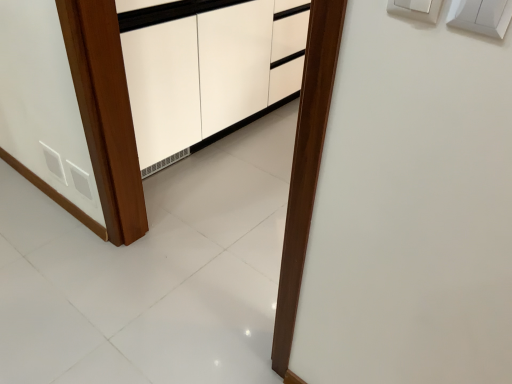
Question: Considering their positions, is white plastic light switch at upper right located in front of or behind white plastic switch at upper right?

Choices:
 (A) front
 (B) behind

Answer: (A)

Question: Considering the positions of white plastic light switch at upper right and white plastic switch at upper right in the image, is white plastic light switch at upper right taller or shorter than white plastic switch at upper right?

Choices:
 (A) short
 (B) tall

Answer: (A)

Question: Would you say white plastic light switch at upper right is inside or outside white plastic switch at upper right?

Choices:
 (A) inside
 (B) outside

Answer: (B)

Question: Would you say white plastic switch at upper right is to the left or to the right of white plastic light switch at upper right in the picture?

Choices:
 (A) left
 (B) right

Answer: (A)

Question: From the image's perspective, is white plastic switch at upper right positioned above or below white plastic light switch at upper right?

Choices:
 (A) above
 (B) below

Answer: (A)

Question: Is white plastic switch at upper right wider or thinner than white plastic light switch at upper right?

Choices:
 (A) thin
 (B) wide

Answer: (A)

Question: Is white plastic switch at upper right in front of or behind white plastic light switch at upper right in the image?

Choices:
 (A) behind
 (B) front

Answer: (A)